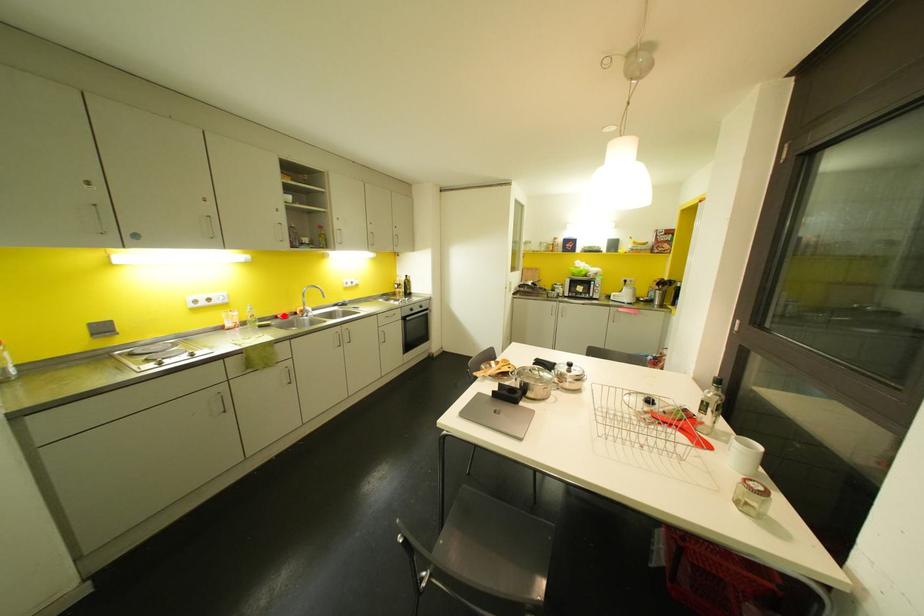
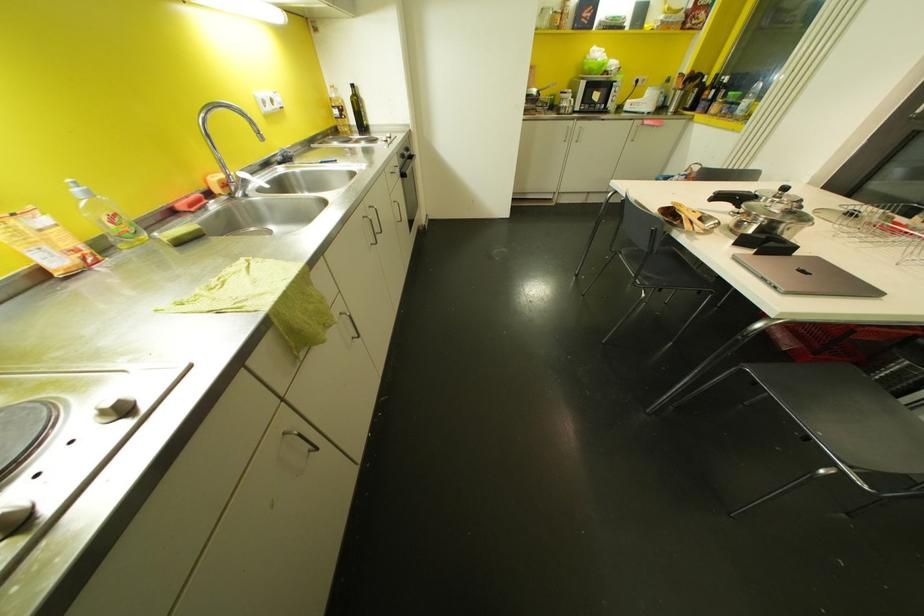
Find the pixel in the second image that matches the highlighted location in the first image.

(198, 204)